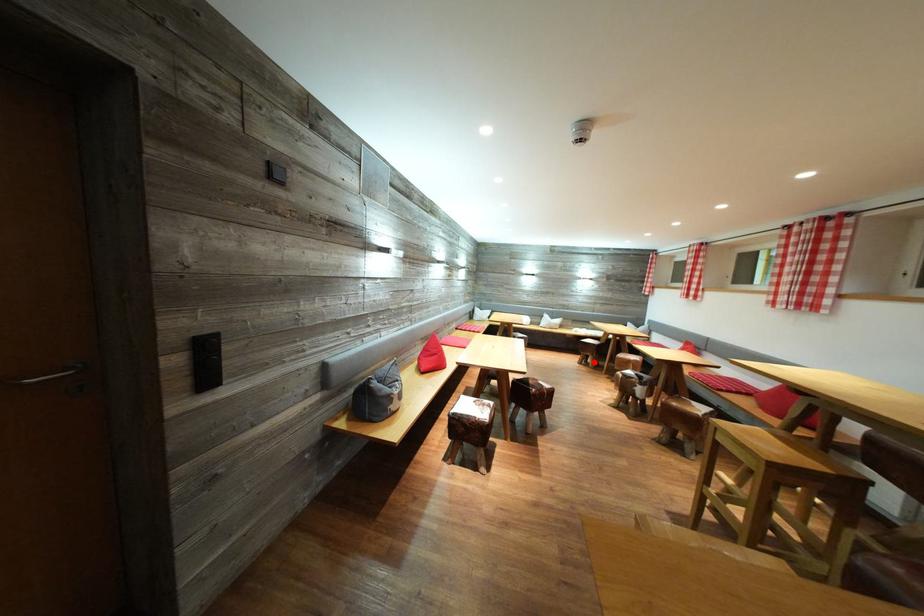
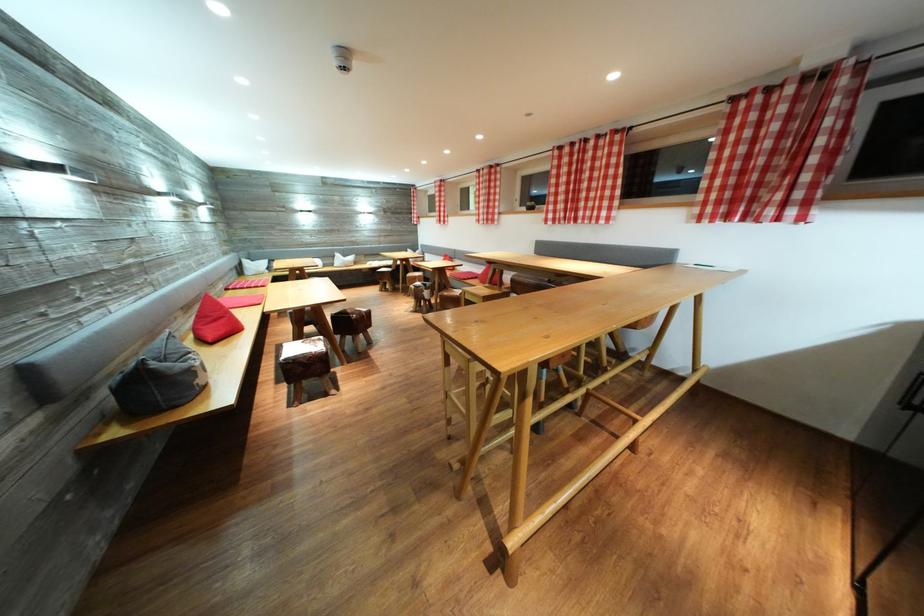
Where in the second image is the point corresponding to the highlighted location from the first image?

(393, 289)